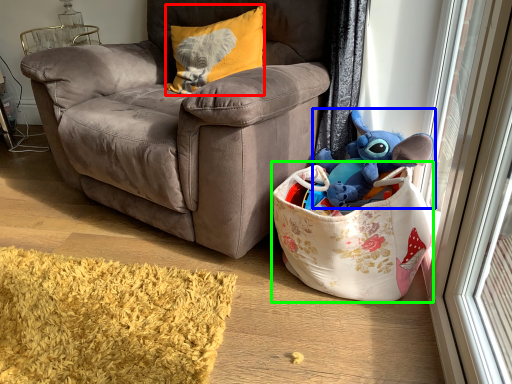
Question: Which is nearer to the pillow (highlighted by a red box)? toy (highlighted by a blue box) or gift basket (highlighted by a green box).

Choices:
 (A) toy
 (B) gift basket

Answer: (A)